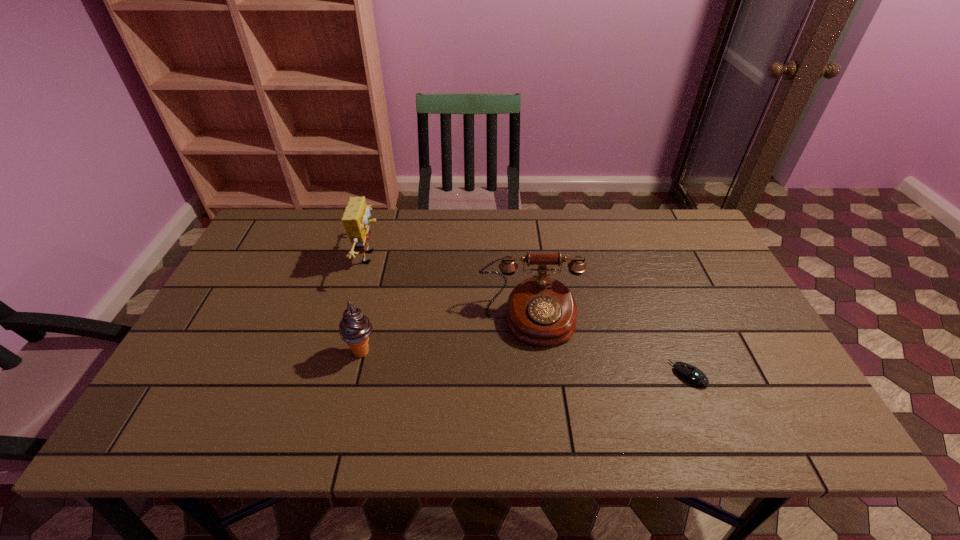
Locate an element on the screen. The width and height of the screenshot is (960, 540). sponge is located at coordinates (355, 219).

This screenshot has height=540, width=960. In order to click on the second object from right to left in this screenshot , I will do `click(541, 311)`.

Where is `icecream`? This screenshot has width=960, height=540. icecream is located at coordinates (355, 328).

Find the location of a particular element. computer mouse is located at coordinates (691, 374).

The height and width of the screenshot is (540, 960). I want to click on the rightmost object, so click(691, 374).

I want to click on free space located 0.260m on the face of the farthest object, so point(468,257).

Identify the location of free location located 0.210m on the dial of the telephone. This screenshot has height=540, width=960. (543, 427).

What are the coordinates of `vacant region located on the right of the icecream` in the screenshot? It's located at (487, 352).

Where is `vacant region located on the front of the rightmost object`? vacant region located on the front of the rightmost object is located at coordinates point(704,412).

Locate an element on the screen. This screenshot has height=540, width=960. object located in the far edge section of the desktop is located at coordinates (355, 219).